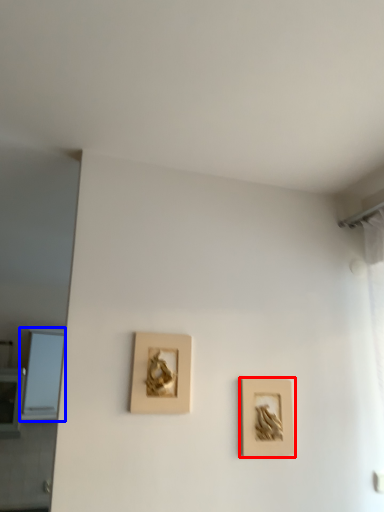
Question: Which point is closer to the camera, picture frame (highlighted by a red box) or window (highlighted by a blue box)?

Choices:
 (A) picture frame
 (B) window

Answer: (A)